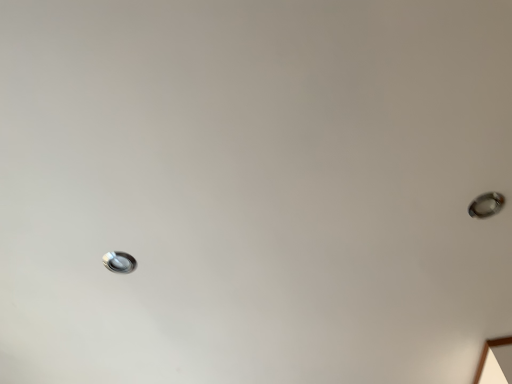
Question: Based on their sizes in the image, would you say satin silver droplight at upper right, marked as the 1th droplight in a right-to-left arrangement, is bigger or smaller than satin silver droplight at lower left, placed as the first droplight when sorted from left to right?

Choices:
 (A) big
 (B) small

Answer: (A)

Question: Considering their positions, is satin silver droplight at upper right, marked as the 1th droplight in a right-to-left arrangement, located in front of or behind satin silver droplight at lower left, which is the second droplight in right-to-left order?

Choices:
 (A) front
 (B) behind

Answer: (A)

Question: Considering the positions of point pos(492,210) and point pos(123,268), is point pos(492,210) closer or farther from the camera than point pos(123,268)?

Choices:
 (A) closer
 (B) farther

Answer: (A)

Question: Relative to satin silver droplight at upper right, which is the second droplight from left to right, is satin silver droplight at lower left, which is the 2th droplight from front to back, in front or behind?

Choices:
 (A) front
 (B) behind

Answer: (B)

Question: In the image, is satin silver droplight at lower left, which is the second droplight from top to bottom, on the left side or the right side of satin silver droplight at upper right, marked as the 2th droplight in a bottom-to-top arrangement?

Choices:
 (A) left
 (B) right

Answer: (A)

Question: Is satin silver droplight at lower left, which is the second droplight from top to bottom, inside the boundaries of satin silver droplight at upper right, the 2th droplight from the back, or outside?

Choices:
 (A) inside
 (B) outside

Answer: (B)

Question: From a real-world perspective, is satin silver droplight at lower left, which is the second droplight from top to bottom, physically located above or below satin silver droplight at upper right, which is the second droplight from left to right?

Choices:
 (A) above
 (B) below

Answer: (A)